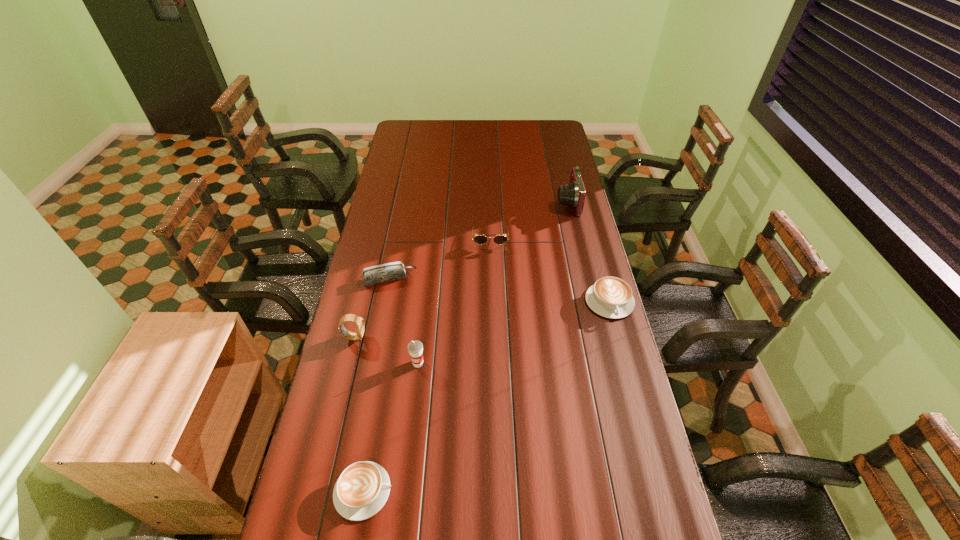
The image size is (960, 540). What are the coordinates of `free space located 0.390m on the side of the second nearest object with the logo` in the screenshot? It's located at (402, 505).

Where is `object present at the near edge`? The image size is (960, 540). object present at the near edge is located at coordinates (362, 489).

Where is `cappuccino present at the left edge`? cappuccino present at the left edge is located at coordinates coord(362,489).

Identify the location of pencil box positioned at the left edge. (387, 272).

Locate an element on the screen. The height and width of the screenshot is (540, 960). watch at the left edge is located at coordinates (359, 321).

I want to click on cappuccino located at the right edge, so click(x=611, y=297).

Where is `camera that is at the right edge`? camera that is at the right edge is located at coordinates (573, 194).

Identify the location of object present at the near left corner. (362, 489).

Find the location of a particular element. vacant space at the far edge of the desktop is located at coordinates (521, 135).

In the image, there is a desktop. At what (x,y) coordinates should I click in order to perform the action: click on vacant space at the left edge. Please return your answer as a coordinate pair (x, y). Looking at the image, I should click on (389, 357).